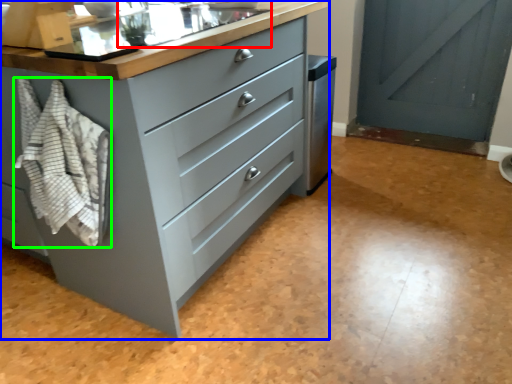
Question: Which object is positioned farthest from sink (highlighted by a red box)? Select from chest of drawers (highlighted by a blue box) and blanket (highlighted by a green box).

Choices:
 (A) chest of drawers
 (B) blanket

Answer: (B)